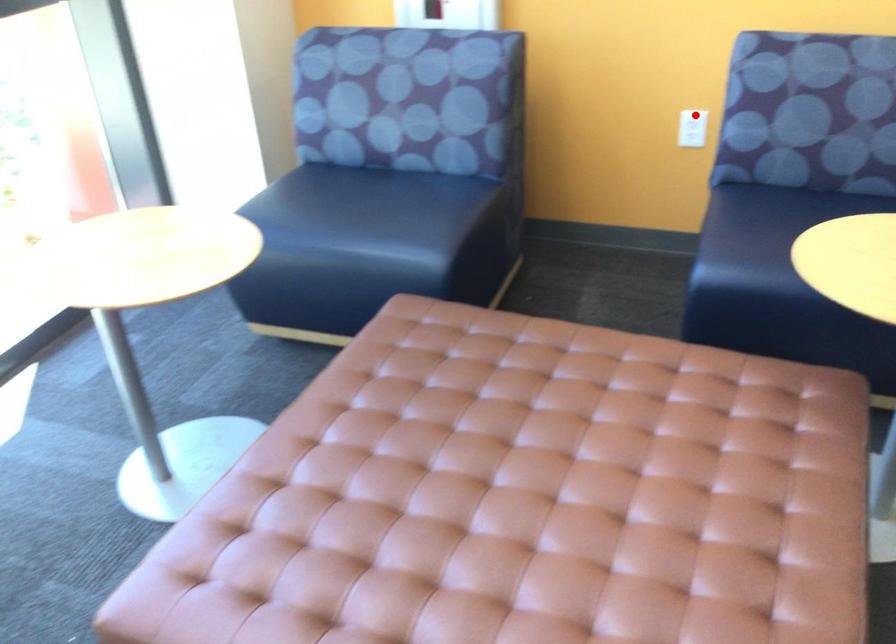
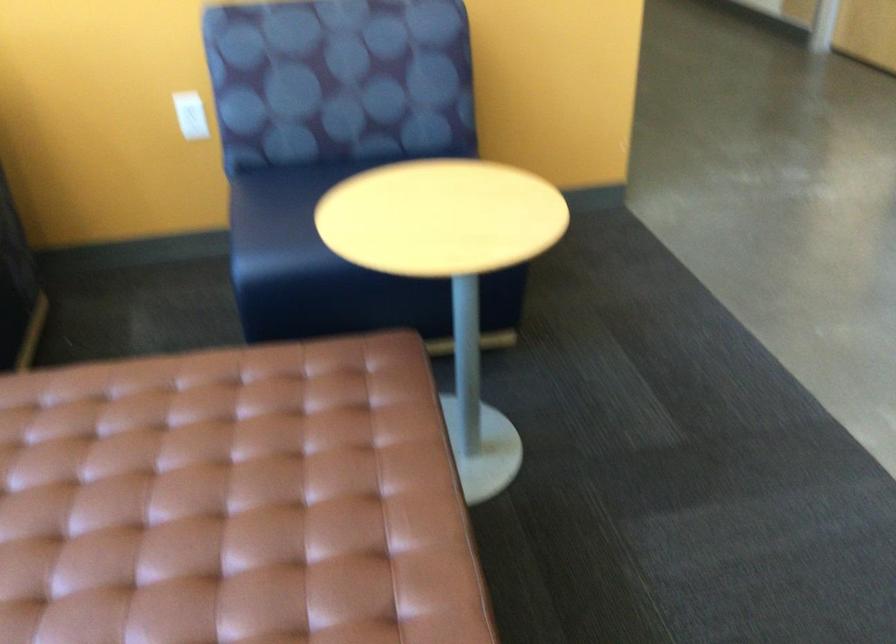
In the second image, find the point that corresponds to the highlighted location in the first image.

(188, 108)